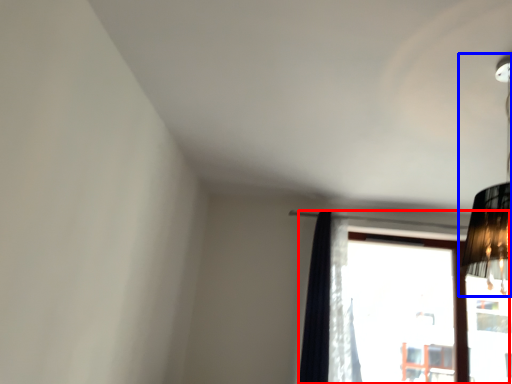
Question: Which point is further to the camera, window (highlighted by a red box) or lamp (highlighted by a blue box)?

Choices:
 (A) window
 (B) lamp

Answer: (A)